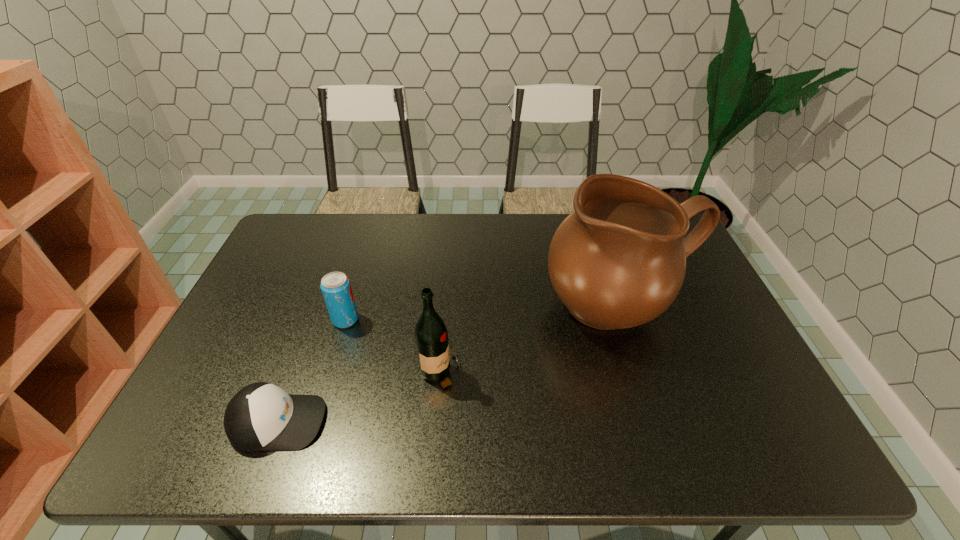
I want to click on object that stands as the third closest to the cap, so click(x=618, y=261).

Locate an element on the screen. free space that satisfies the following two spatial constraints: 1. on the front side of the second object from right to left; 2. on the left side of the third tallest object is located at coordinates (328, 374).

Locate an element on the screen. The image size is (960, 540). vacant space that satisfies the following two spatial constraints: 1. on the front side of the third tallest object; 2. on the front panel of the shortest object is located at coordinates (314, 422).

What are the coordinates of `free location that satisfies the following two spatial constraints: 1. on the front side of the second shortest object; 2. on the front panel of the nearest object` in the screenshot? It's located at (314, 422).